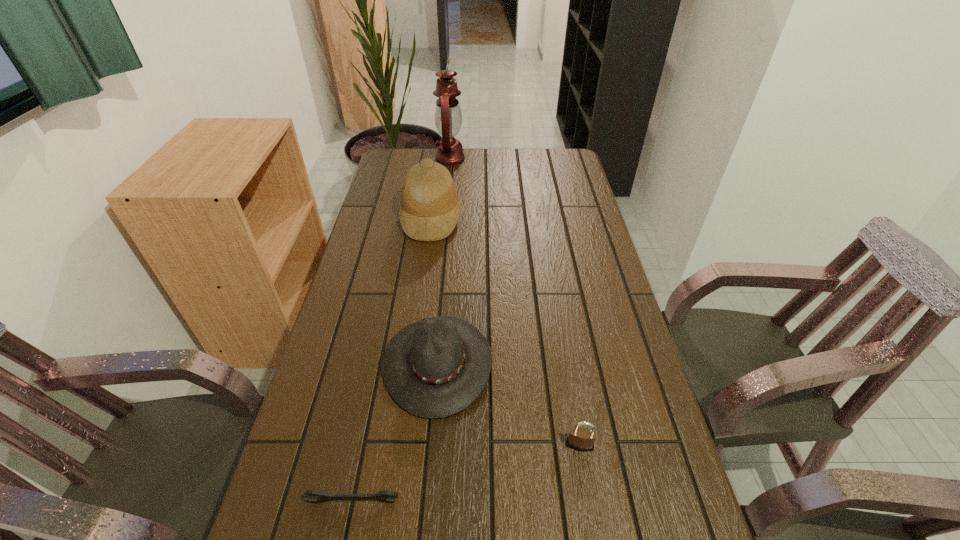
Locate an element on the screen. Image resolution: width=960 pixels, height=540 pixels. free spot that satisfies the following two spatial constraints: 1. on the front-facing side of the shorter hat; 2. on the right side of the second shortest object is located at coordinates (432, 445).

Find the location of `free spot that satisfies the following two spatial constraints: 1. on the front-facing side of the fourth shortest object; 2. on the open ends of the nearest object`. free spot that satisfies the following two spatial constraints: 1. on the front-facing side of the fourth shortest object; 2. on the open ends of the nearest object is located at coordinates 392,502.

The width and height of the screenshot is (960, 540). I want to click on free spot that satisfies the following two spatial constraints: 1. on the front-facing side of the padlock; 2. on the right side of the fourth nearest object, so click(x=399, y=445).

At what (x,y) coordinates should I click in order to perform the action: click on vacant position in the image that satisfies the following two spatial constraints: 1. on the front-facing side of the nearer hat; 2. on the open ends of the wrench. Please return your answer as a coordinate pair (x, y). The height and width of the screenshot is (540, 960). Looking at the image, I should click on (427, 502).